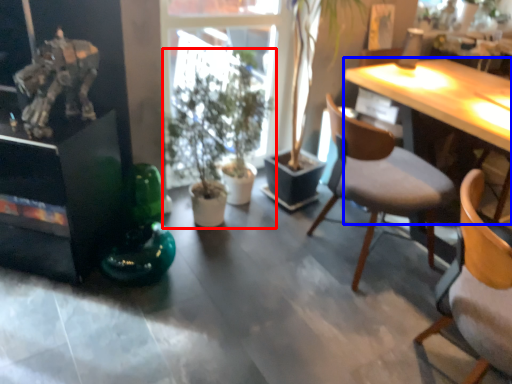
Question: Which of the following is the closest to the observer, houseplant (highlighted by a red box) or desk (highlighted by a blue box)?

Choices:
 (A) houseplant
 (B) desk

Answer: (A)